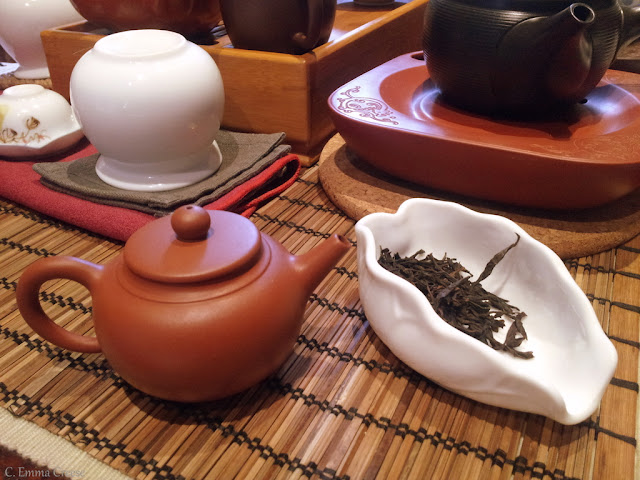
Identify the location of white dishes. (422, 341), (141, 120), (43, 108), (16, 23).